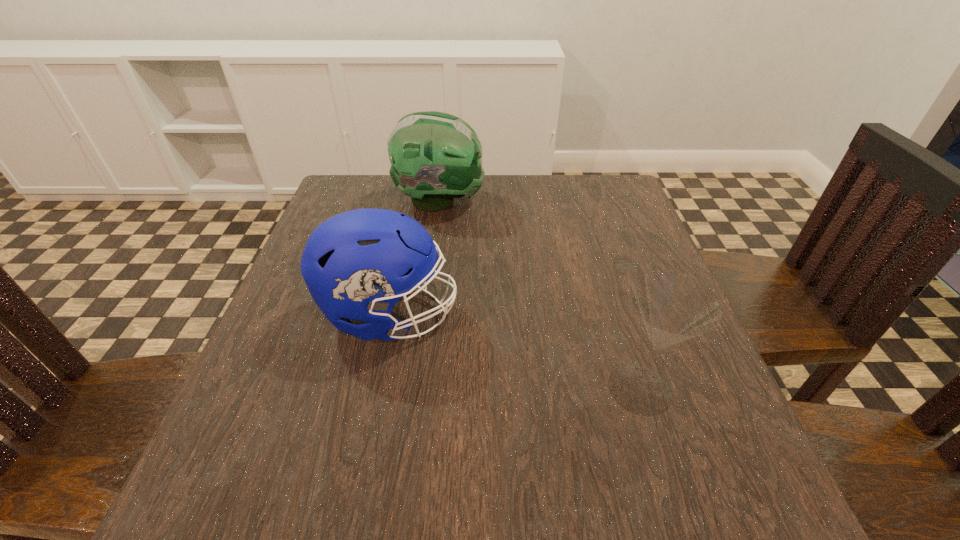
Locate an element on the screen. This screenshot has width=960, height=540. the farther football helmet is located at coordinates (435, 157).

Identify the location of the nearer football helmet. Image resolution: width=960 pixels, height=540 pixels. (357, 265).

I want to click on the nearest object, so click(672, 308).

The height and width of the screenshot is (540, 960). Find the location of `the rightmost object`. the rightmost object is located at coordinates (672, 308).

You are a GUI agent. You are given a task and a screenshot of the screen. Output one action in this format:
    pyautogui.click(x=<x>, y=<y>)
    Task: Click on the free space located on the visor of the farthest object
    The image size is (960, 540).
    Given the screenshot: What is the action you would take?
    pyautogui.click(x=616, y=201)

Find the location of a particular element. The width and height of the screenshot is (960, 540). vacant position located on the front-facing side of the nearer football helmet is located at coordinates click(516, 314).

Locate an element on the screen. The height and width of the screenshot is (540, 960). blank space located on the left of the flute glass is located at coordinates (376, 388).

Where is `object present at the far edge`? This screenshot has height=540, width=960. object present at the far edge is located at coordinates (435, 157).

You are a GUI agent. You are given a task and a screenshot of the screen. Output one action in this format:
    pyautogui.click(x=<x>, y=<y>)
    Task: Click on the object that is at the left edge
    
    Given the screenshot: What is the action you would take?
    pyautogui.click(x=357, y=265)

This screenshot has height=540, width=960. Find the location of `object that is at the right edge`. object that is at the right edge is located at coordinates (672, 308).